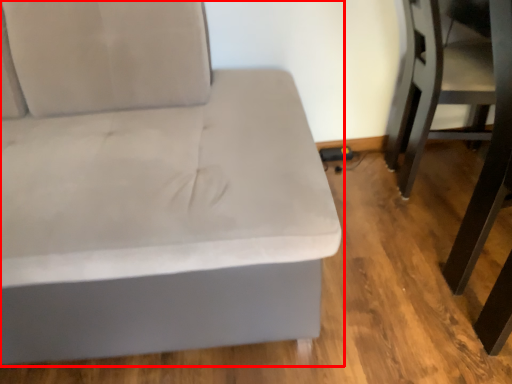
Question: In this image, where is studio couch (annotated by the red box) located relative to swivel chair?

Choices:
 (A) left
 (B) right

Answer: (A)